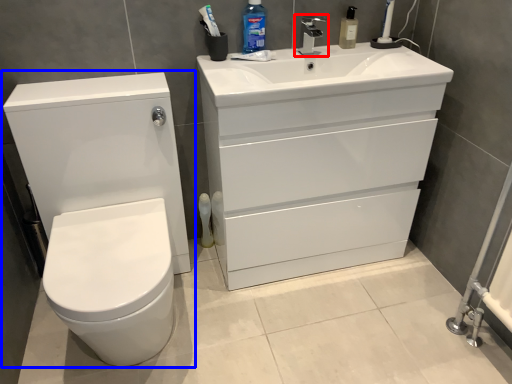
Question: Which object is closer to the camera taking this photo, tap (highlighted by a red box) or toilet (highlighted by a blue box)?

Choices:
 (A) tap
 (B) toilet

Answer: (B)